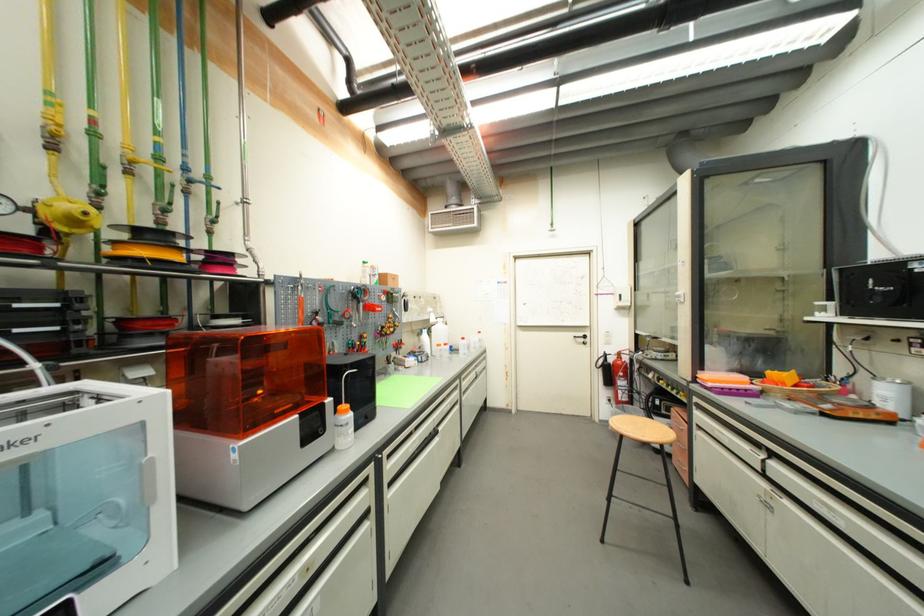
This screenshot has height=616, width=924. What do you see at coordinates (610, 370) in the screenshot? I see `a appliance control dial` at bounding box center [610, 370].